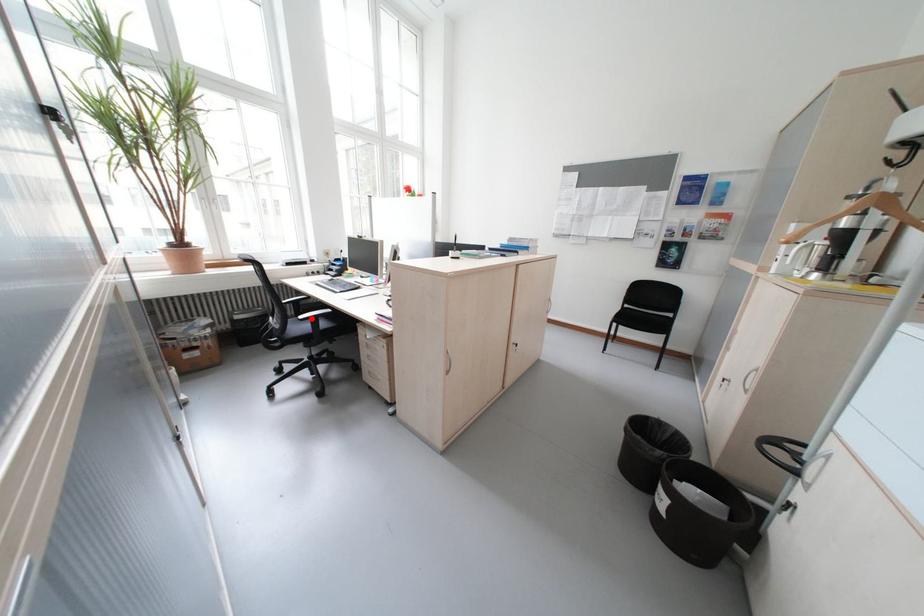
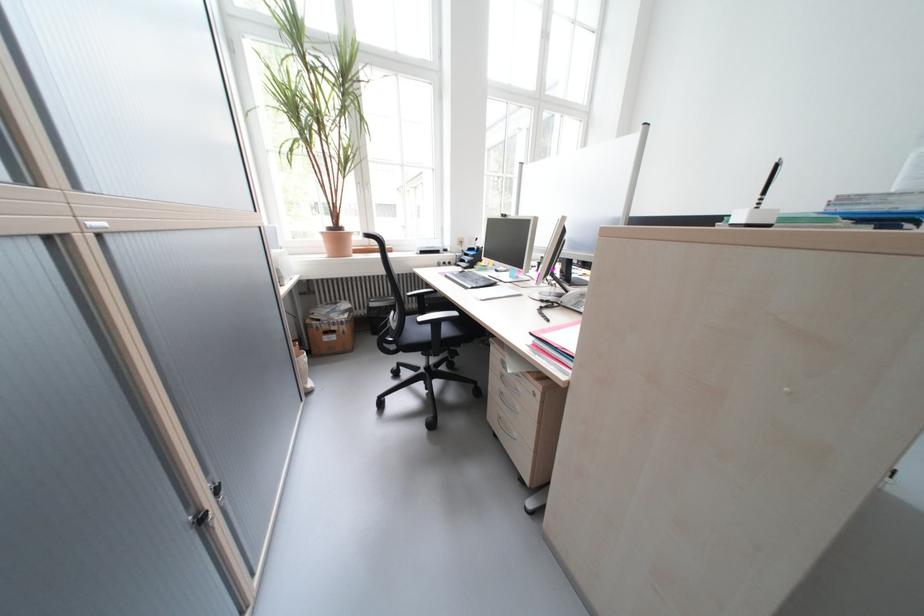
Where in the second image is the point corresponding to the highlighted location from the first image?

(431, 320)